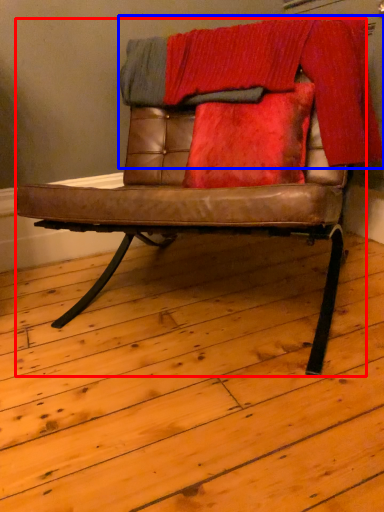
Question: Which object is further to the camera taking this photo, chair (highlighted by a red box) or blanket (highlighted by a blue box)?

Choices:
 (A) chair
 (B) blanket

Answer: (B)